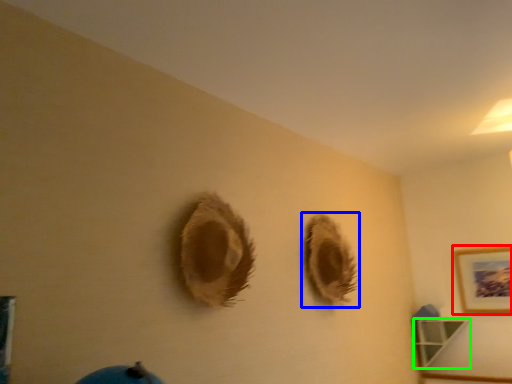
Question: Which object is positioned closest to picture frame (highlighted by a red box)? Select from hole (highlighted by a blue box) and shelf (highlighted by a green box).

Choices:
 (A) hole
 (B) shelf

Answer: (B)